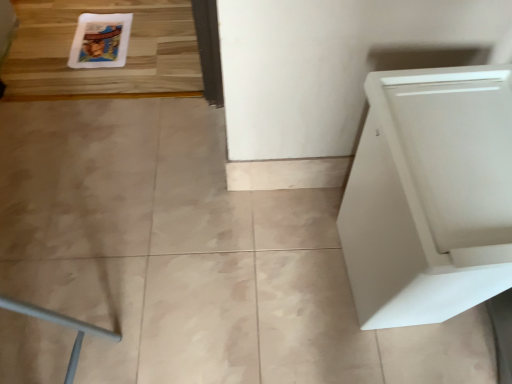
In order to click on free point above white glossy comic book at upper left (from a real-world perspective) in this screenshot , I will do pos(98,40).